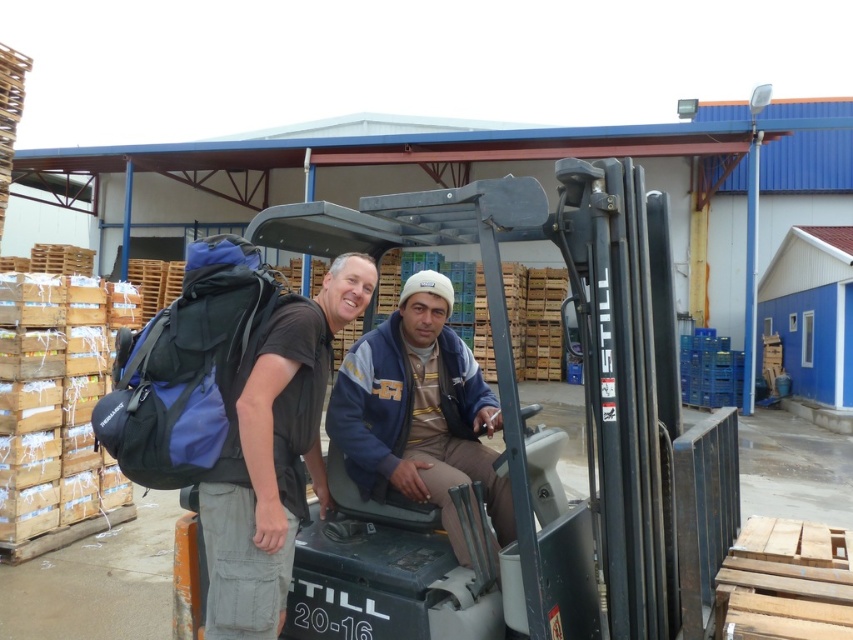
Does point (207, 616) come farther from viewer compared to point (412, 355)?

No, (207, 616) is in front of (412, 355).

Identify the location of dark blue backpack at left. (274, 456).